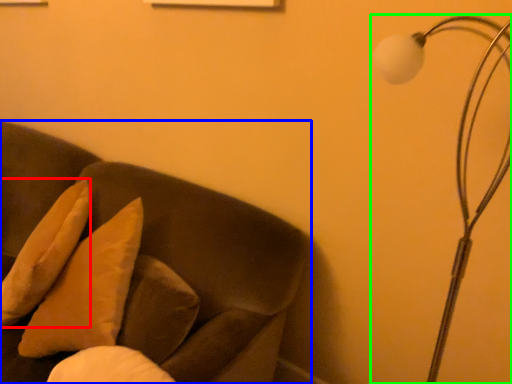
Question: Which object is positioned closest to pillow (highlighted by a red box)? Select from furniture (highlighted by a blue box) and lamp (highlighted by a green box).

Choices:
 (A) furniture
 (B) lamp

Answer: (A)